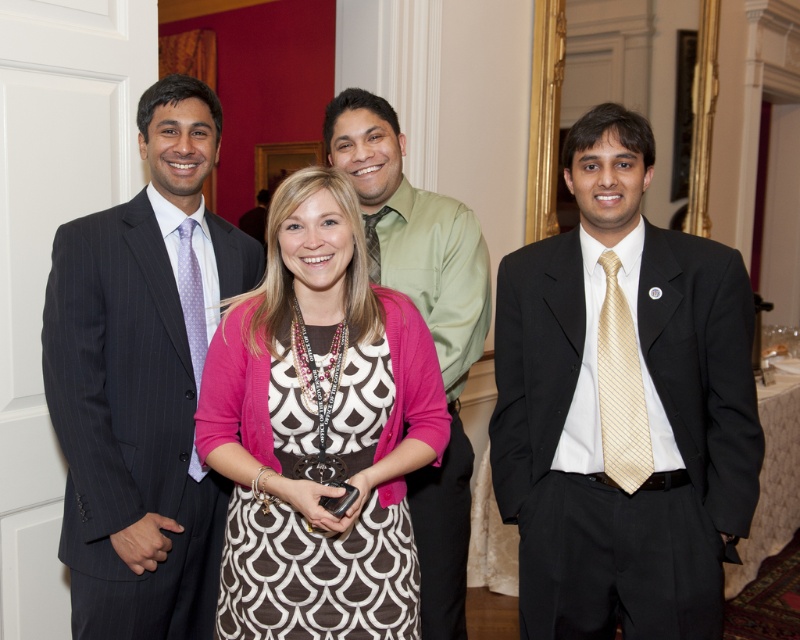
Does matte black suit at left have a larger size compared to gold striped tie at right?

Correct, matte black suit at left is larger in size than gold striped tie at right.

Between matte black suit at left and gold striped tie at right, which one appears on the left side from the viewer's perspective?

matte black suit at left

Is point (144, 320) in front of point (618, 292)?

No, (144, 320) is further to viewer.

This screenshot has height=640, width=800. Identify the location of matte black suit at left. (144, 381).

Consider the image. Which is more to the right, patterned fabric dress at center or green matte shirt at center?

green matte shirt at center is more to the right.

Does point (316, 307) come behind point (432, 195)?

No, (316, 307) is in front of (432, 195).

Where is `patterned fabric dress at center`? patterned fabric dress at center is located at coordinates (320, 429).

Who is more forward, (182, 278) or (368, 236)?

Point (182, 278)

What do you see at coordinates (192, 298) in the screenshot? I see `purple dotted tie at left` at bounding box center [192, 298].

Does point (204, 472) come farther from viewer compared to point (376, 275)?

No, it is in front of (376, 275).

Where is `purple dotted tie at left`? This screenshot has width=800, height=640. purple dotted tie at left is located at coordinates (192, 298).